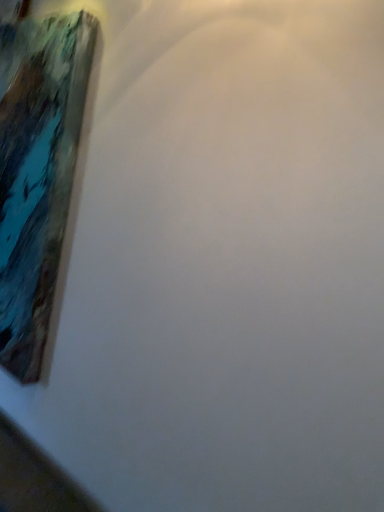
I want to click on painted wood picture frame at upper left, so click(37, 172).

Image resolution: width=384 pixels, height=512 pixels. What do you see at coordinates (37, 172) in the screenshot? I see `painted wood picture frame at upper left` at bounding box center [37, 172].

Locate an element on the screen. This screenshot has width=384, height=512. painted wood picture frame at upper left is located at coordinates (37, 172).